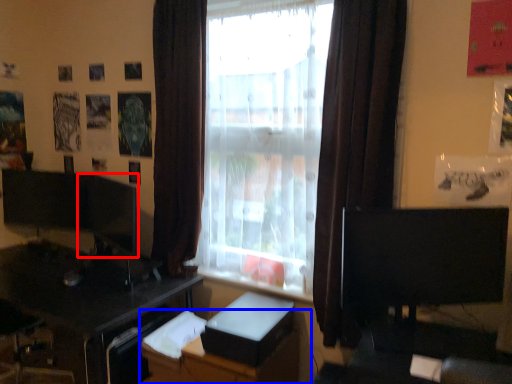
Question: Among these objects, which one is farthest to the camera, computer monitor (highlighted by a red box) or dresser (highlighted by a blue box)?

Choices:
 (A) computer monitor
 (B) dresser

Answer: (A)